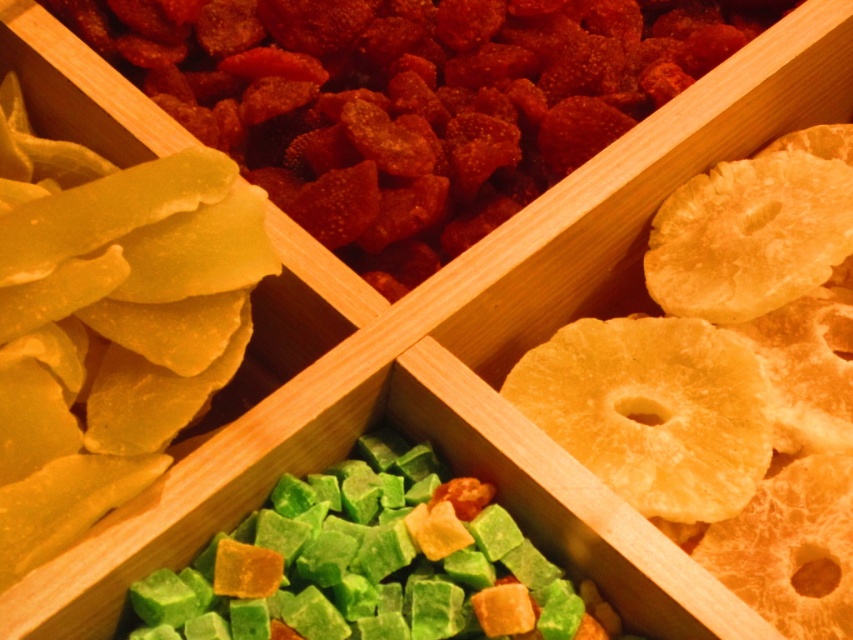
Between yellow translucent gummy at upper left and golden textured pineapple slices at right, which one is positioned higher?

yellow translucent gummy at upper left

Between point (527, 115) and point (704, 426), which one is positioned in front?

Point (704, 426) is more forward.

Find the location of `yellow translucent gummy at upper left`. yellow translucent gummy at upper left is located at coordinates (410, 99).